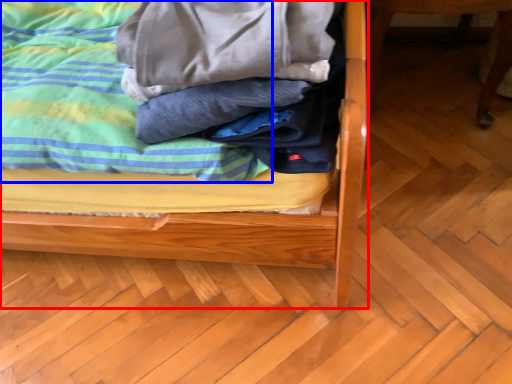
Question: Which point is closer to the camera, bed (highlighted by a red box) or blanket (highlighted by a blue box)?

Choices:
 (A) bed
 (B) blanket

Answer: (A)